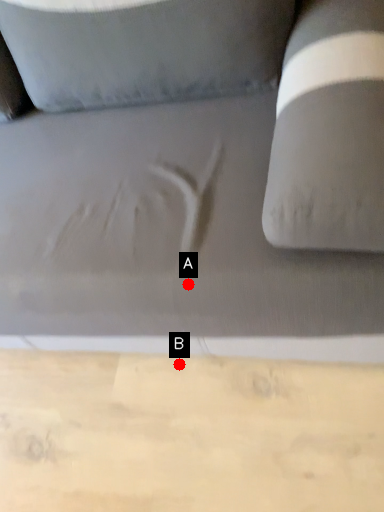
Question: Two points are circled on the image, labeled by A and B beside each circle. Which point is closer to the camera taking this photo?

Choices:
 (A) A is closer
 (B) B is closer

Answer: (A)